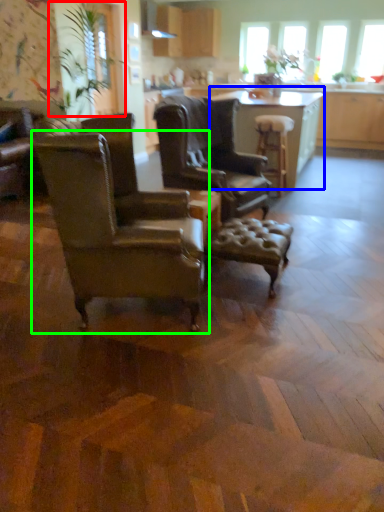
Question: Based on their relative distances, which object is nearer to plant (highlighted by a red box)? Choose from table (highlighted by a blue box) and chair (highlighted by a green box).

Choices:
 (A) table
 (B) chair

Answer: (A)